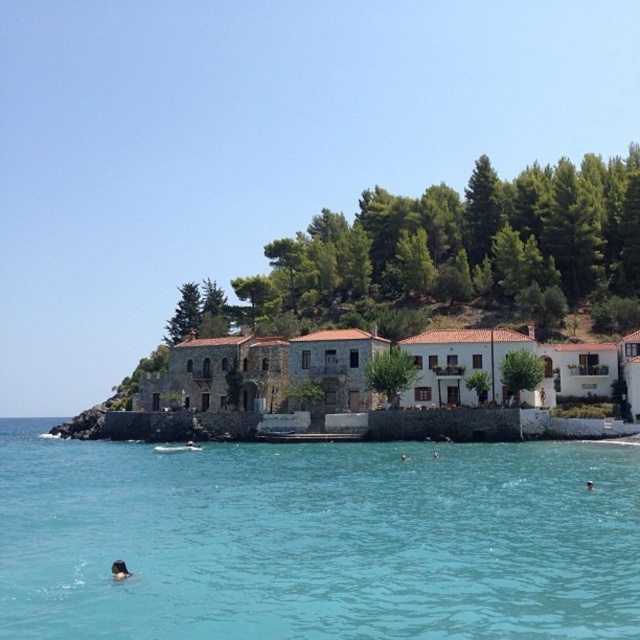
You are a photographer trying to capture a group photo of the black matte person at lower left and the brown hair at lower center in the coastal scene. Based on their positions and sizes, which person should you focus on first to ensure they are in the frame?

The black matte person at lower left might be wider than brown hair at lower center, so you should focus on the black matte person at lower left first to ensure they fit within the frame due to their potentially larger size.

You are standing at the point marked as point (115, 576) and want to walk to the point marked as point (589, 488). Given that the terrain between them is uneven with possible obstacles, which direction should you move to reach your destination?

You should move towards the lower right direction since point (589, 488) is located further away from the camera compared to your current position at point (115, 576).

Looking at this image, you are standing at the edge of the coast looking at the scene. There are two points marked in the image. The first point is at coordinates point (499, 522) and the second point is at point (588, 484). Which of these two points is nearer to you?

Point (499, 522) is closer to the camera than point (588, 484), so the first point is nearer to you.